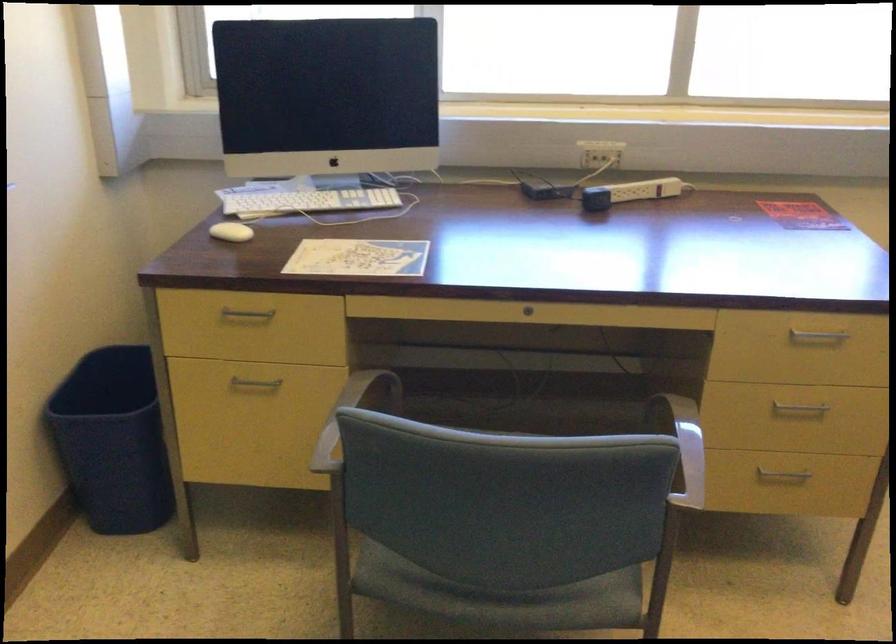
Where would you plugging in the black power adapter? Please return your answer as a coordinate pair (x, y).

(544, 187)